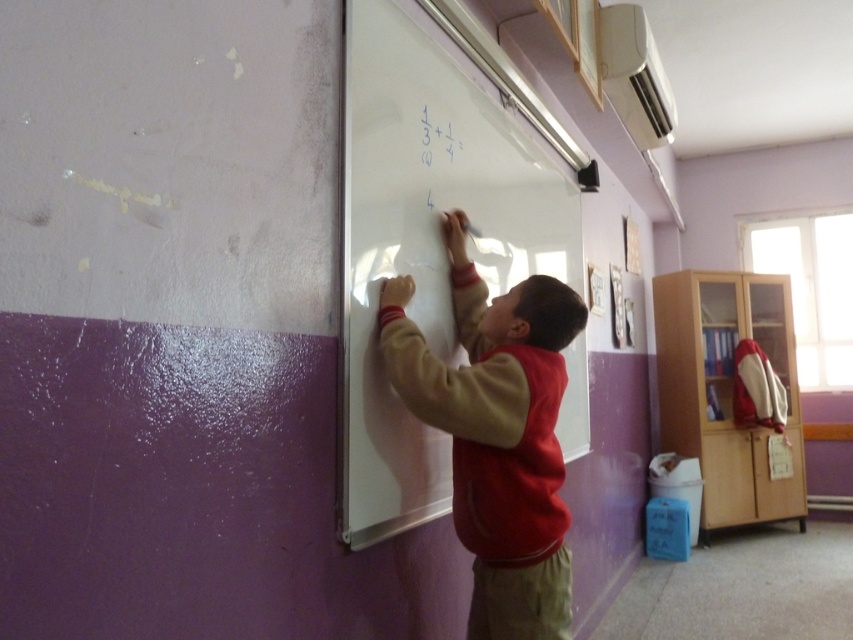
You are a teacher observing a student in the classroom. The student is wearing a red fleece vest at center and is working on a whiteboard at center. Which object is located to the right of the other?

The whiteboard at center is positioned on the right side of the red fleece vest at center.

You are a teacher standing in front of the classroom. You need to write an important note on the whiteboard at center, but you also want to ensure the red fleece vest at center is visible to the students. Can you write the note without covering the vest?

The whiteboard at center is in front of the red fleece vest at center, so writing on the whiteboard at center will cover the vest. To keep the vest visible, write on a part of the whiteboard that doesn not overlap with the vest.